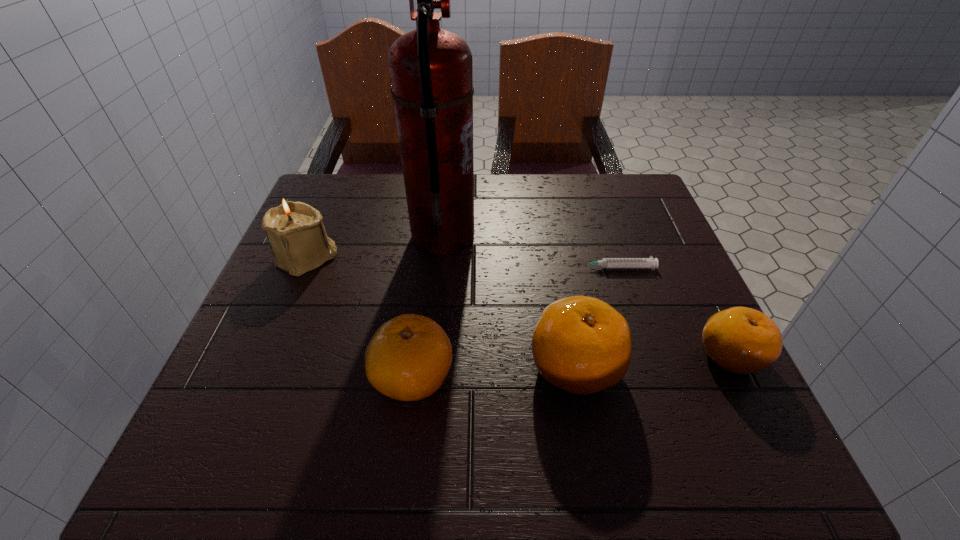
Identify which clementine is the second closest to the fire extinguisher. Please provide its 2D coordinates. Your answer should be formatted as a tuple, i.e. [(x, y)], where the tuple contains the x and y coordinates of a point satisfying the conditions above.

[(408, 358)]

Identify the location of vacant area in the image that satisfies the following two spatial constraints: 1. on the nozzle side of the tallest object; 2. on the front side of the second tallest clementine. The width and height of the screenshot is (960, 540). (430, 376).

At what (x,y) coordinates should I click in order to perform the action: click on vacant region that satisfies the following two spatial constraints: 1. at the needle end of the shortest clementine; 2. on the right side of the syringe. Please return your answer as a coordinate pair (x, y). The height and width of the screenshot is (540, 960). Looking at the image, I should click on (643, 356).

Where is `blank area in the image that satisfies the following two spatial constraints: 1. at the needle end of the rightmost clementine; 2. on the left side of the syringe`? This screenshot has height=540, width=960. blank area in the image that satisfies the following two spatial constraints: 1. at the needle end of the rightmost clementine; 2. on the left side of the syringe is located at coordinates (643, 356).

Where is `free location that satisfies the following two spatial constraints: 1. on the nozzle side of the rightmost clementine; 2. on the left side of the tallest object`? This screenshot has height=540, width=960. free location that satisfies the following two spatial constraints: 1. on the nozzle side of the rightmost clementine; 2. on the left side of the tallest object is located at coordinates (432, 356).